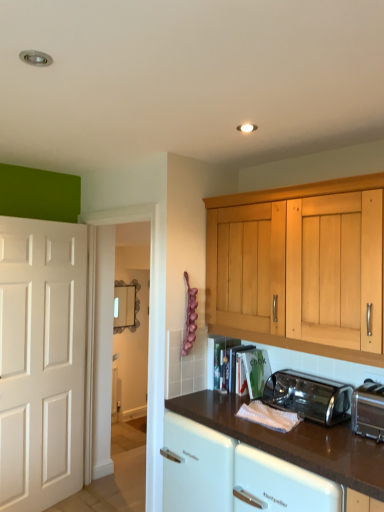
Question: From the image's perspective, is silver metallic toaster at lower right, marked as the first toaster in a front-to-back arrangement, on top of polished stainless steel toaster at lower center, the 1th toaster when ordered from back to front?

Choices:
 (A) no
 (B) yes

Answer: (B)

Question: Considering the relative positions of silver metallic toaster at lower right, arranged as the 2th toaster when viewed from the back, and polished stainless steel toaster at lower center, the 1th toaster when ordered from back to front, in the image provided, is silver metallic toaster at lower right, arranged as the 2th toaster when viewed from the back, to the left of polished stainless steel toaster at lower center, the 1th toaster when ordered from back to front, from the viewer's perspective?

Choices:
 (A) yes
 (B) no

Answer: (B)

Question: Is silver metallic toaster at lower right, marked as the first toaster in a front-to-back arrangement, behind polished stainless steel toaster at lower center, which is the second toaster from front to back?

Choices:
 (A) no
 (B) yes

Answer: (A)

Question: Could polished stainless steel toaster at lower center, the 1th toaster when ordered from back to front, be considered to be inside silver metallic toaster at lower right, arranged as the 2th toaster when viewed from the back?

Choices:
 (A) no
 (B) yes

Answer: (A)

Question: Can you confirm if silver metallic toaster at lower right, arranged as the 2th toaster when viewed from the back, is bigger than polished stainless steel toaster at lower center, which is the second toaster from front to back?

Choices:
 (A) no
 (B) yes

Answer: (A)

Question: Considering the positions of brown glossy countertop at lower center and silver metallic toaster at lower right, arranged as the 2th toaster when viewed from the back, in the image, is brown glossy countertop at lower center bigger or smaller than silver metallic toaster at lower right, arranged as the 2th toaster when viewed from the back,?

Choices:
 (A) small
 (B) big

Answer: (B)

Question: Visually, is brown glossy countertop at lower center positioned to the left or to the right of silver metallic toaster at lower right, arranged as the 2th toaster when viewed from the back?

Choices:
 (A) left
 (B) right

Answer: (A)

Question: Is point (292, 454) positioned closer to the camera than point (377, 431)?

Choices:
 (A) closer
 (B) farther

Answer: (A)

Question: Is brown glossy countertop at lower center wider or thinner than silver metallic toaster at lower right, marked as the first toaster in a front-to-back arrangement?

Choices:
 (A) wide
 (B) thin

Answer: (A)

Question: In terms of width, does polished stainless steel toaster at lower center, which is the second toaster from front to back, look wider or thinner when compared to brown glossy countertop at lower center?

Choices:
 (A) thin
 (B) wide

Answer: (A)

Question: Considering the positions of polished stainless steel toaster at lower center, which is the second toaster from front to back, and brown glossy countertop at lower center in the image, is polished stainless steel toaster at lower center, which is the second toaster from front to back, bigger or smaller than brown glossy countertop at lower center?

Choices:
 (A) small
 (B) big

Answer: (A)

Question: From the image's perspective, is polished stainless steel toaster at lower center, which is the second toaster from front to back, located above or below brown glossy countertop at lower center?

Choices:
 (A) below
 (B) above

Answer: (B)

Question: In terms of height, does polished stainless steel toaster at lower center, the 1th toaster when ordered from back to front, look taller or shorter compared to brown glossy countertop at lower center?

Choices:
 (A) tall
 (B) short

Answer: (B)

Question: Is polished stainless steel toaster at lower center, which is the second toaster from front to back, in front of or behind silver metallic toaster at lower right, marked as the first toaster in a front-to-back arrangement, in the image?

Choices:
 (A) front
 (B) behind

Answer: (B)

Question: From a real-world perspective, is polished stainless steel toaster at lower center, the 1th toaster when ordered from back to front, physically located above or below silver metallic toaster at lower right, arranged as the 2th toaster when viewed from the back?

Choices:
 (A) above
 (B) below

Answer: (B)